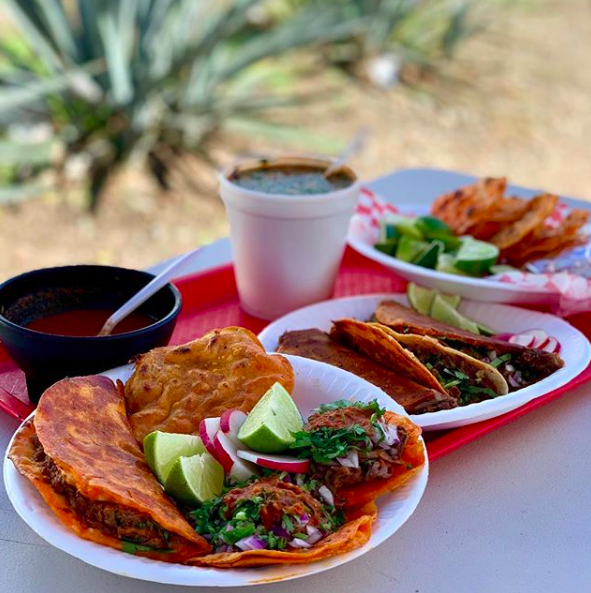
The width and height of the screenshot is (591, 593). In order to click on bowl in this screenshot , I will do `click(69, 353)`.